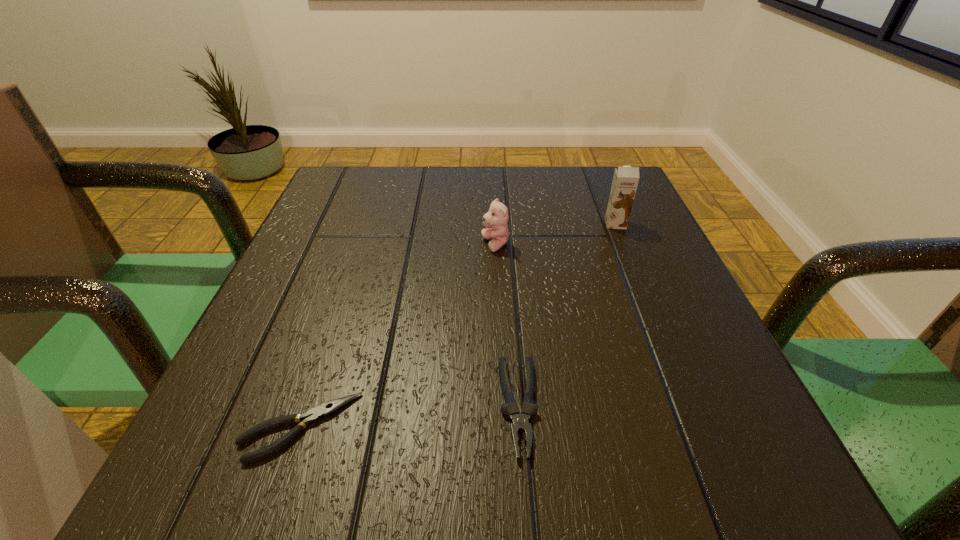
You are a GUI agent. You are given a task and a screenshot of the screen. Output one action in this format:
    pyautogui.click(x=<x>, y=<y>)
    Task: Click on the free region located 0.230m at the face of the teddy bear
    The image size is (960, 540).
    Given the screenshot: What is the action you would take?
    pyautogui.click(x=366, y=245)

Identify the location of vacant space located at the face of the teddy bear. (426, 245).

Find the location of a particular element. This screenshot has width=960, height=540. free location located on the back of the shortest object is located at coordinates (359, 253).

The image size is (960, 540). In order to click on object at the far edge in this screenshot , I will do `click(625, 181)`.

I want to click on object situated at the left edge, so click(x=314, y=415).

Identify the location of object that is at the right edge. (625, 181).

Find the location of a particular element. The width and height of the screenshot is (960, 540). object at the near left corner is located at coordinates tap(314, 415).

Locate an element on the screen. The height and width of the screenshot is (540, 960). object at the far right corner is located at coordinates (625, 181).

Locate an element on the screen. blank space at the far edge of the desktop is located at coordinates (414, 216).

This screenshot has height=540, width=960. In the image, there is a desktop. Identify the location of vacant space at the left edge. (352, 258).